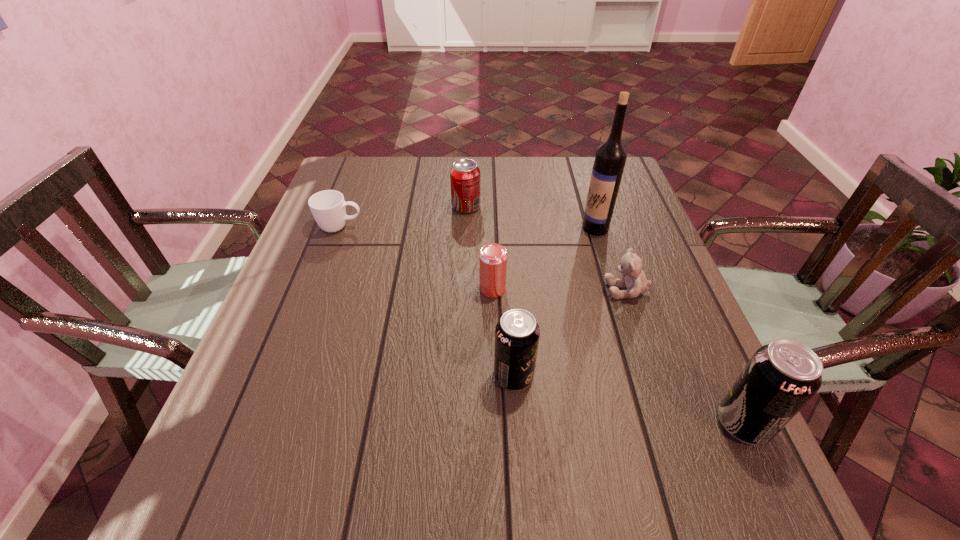
What are the coordinates of `free spot at the right edge of the desktop` in the screenshot? It's located at [675, 359].

In order to click on vacant space at the near right corner of the desktop in this screenshot , I will do `click(708, 429)`.

I want to click on unoccupied position between the sixth farthest object and the sixth shortest object, so click(x=629, y=400).

Identify the location of vacant area that lies between the shortest soda can and the second tallest object. The width and height of the screenshot is (960, 540). (605, 315).

In order to click on blank region between the fourth tallest object and the tallest object in this screenshot , I will do `click(531, 217)`.

Image resolution: width=960 pixels, height=540 pixels. In order to click on vacant area that lies between the tallest soda can and the teddy bear in this screenshot , I will do `click(685, 356)`.

Image resolution: width=960 pixels, height=540 pixels. Identify the location of free space that is in between the nearest object and the second nearest object. (629, 400).

Find the location of a particular element. This screenshot has width=960, height=540. empty space between the farthest soda can and the wine bottle is located at coordinates (531, 217).

Image resolution: width=960 pixels, height=540 pixels. I want to click on vacant space that is in between the wine bottle and the sixth farthest object, so click(554, 302).

Identify the location of unoccupied area between the teddy bear and the tallest object. The height and width of the screenshot is (540, 960). [612, 259].